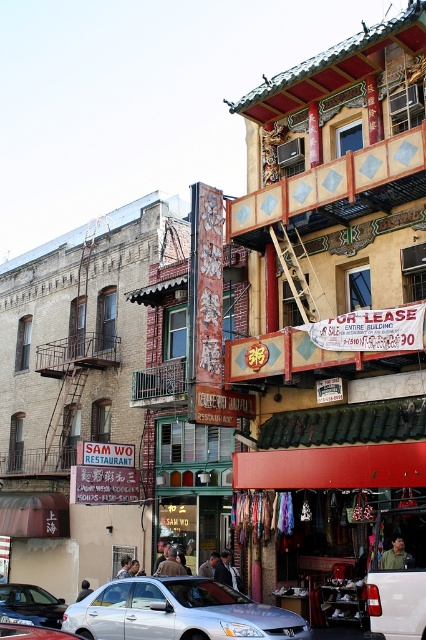
Question: Considering the real-world distances, which object is farthest from the wooden at center?

Choices:
 (A) satin silver sedan at lower left
 (B) silver metallic car at center

Answer: (B)

Question: Is silver metallic sedan at center to the right of wooden at center from the viewer's perspective?

Choices:
 (A) yes
 (B) no

Answer: (B)

Question: Does wooden at center have a lesser width compared to silver metallic car at center?

Choices:
 (A) no
 (B) yes

Answer: (B)

Question: Considering the relative positions of silver metallic sedan at center and wooden at center in the image provided, where is silver metallic sedan at center located with respect to wooden at center?

Choices:
 (A) below
 (B) above

Answer: (A)

Question: Which point is closer to the camera taking this photo?

Choices:
 (A) (307, 636)
 (B) (31, 616)
 (C) (71, 632)

Answer: (A)

Question: Among these objects, which one is farthest from the camera?

Choices:
 (A) silver metallic car at center
 (B) silver metallic sedan at center
 (C) wooden at center
 (D) satin silver sedan at lower left

Answer: (C)